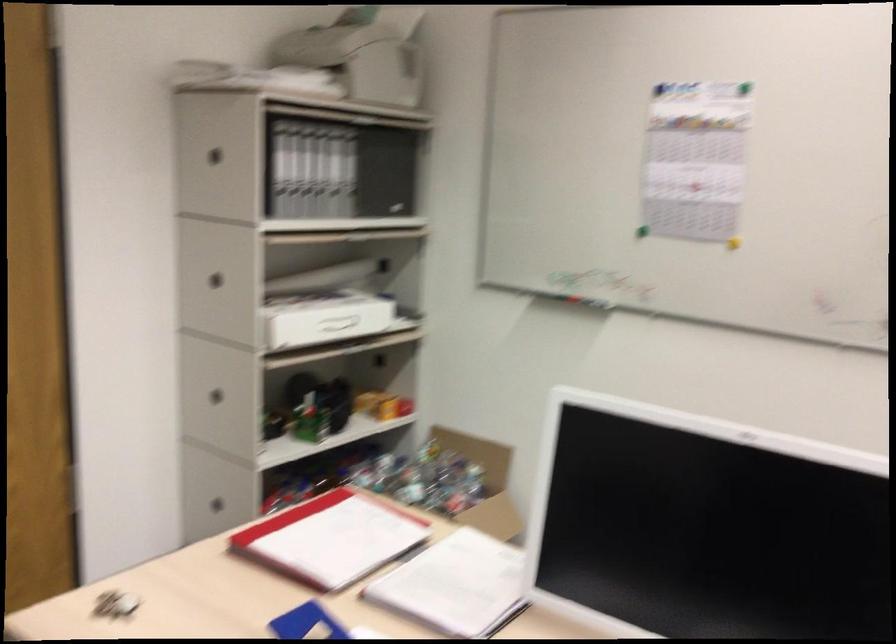
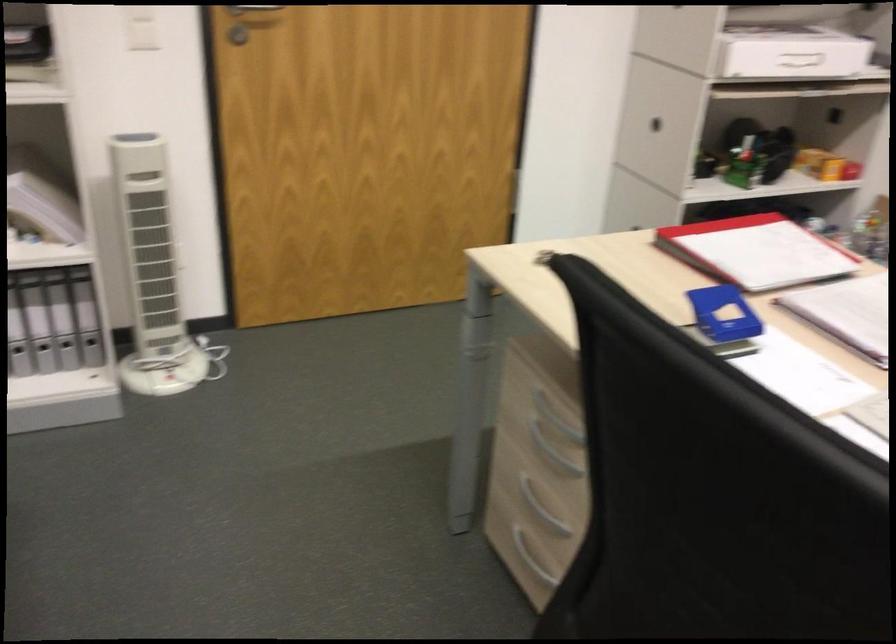
How did the camera likely rotate?

The camera rotated toward left-down.